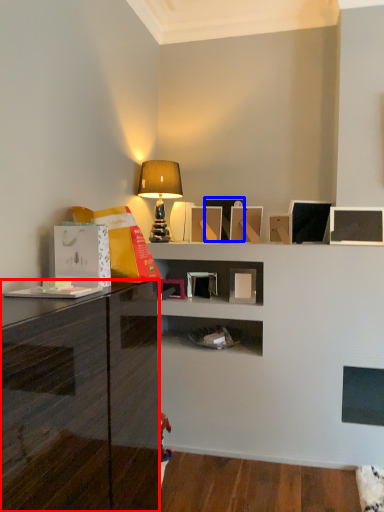
Question: Which object is closer to the camera taking this photo, cabinetry (highlighted by a red box) or picture frame (highlighted by a blue box)?

Choices:
 (A) cabinetry
 (B) picture frame

Answer: (A)